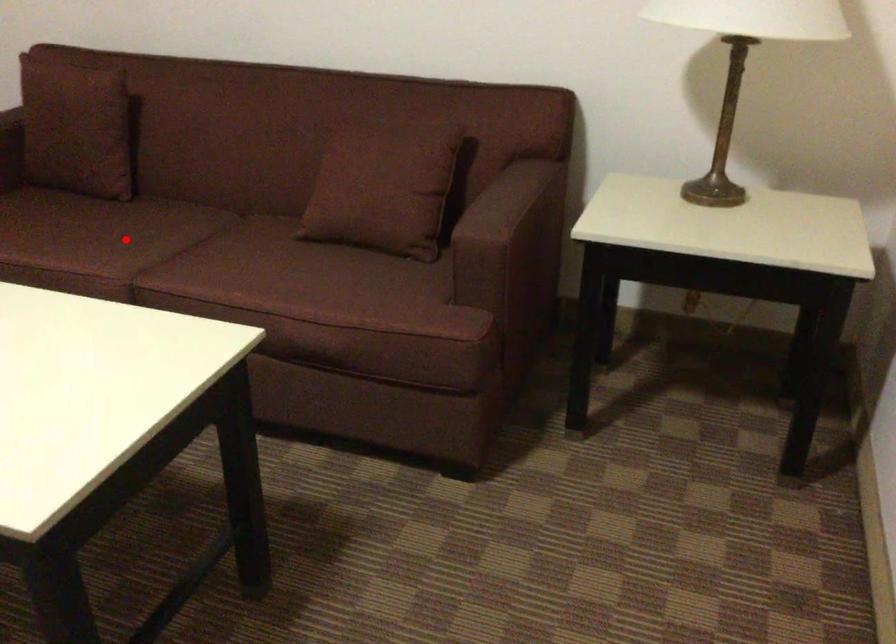
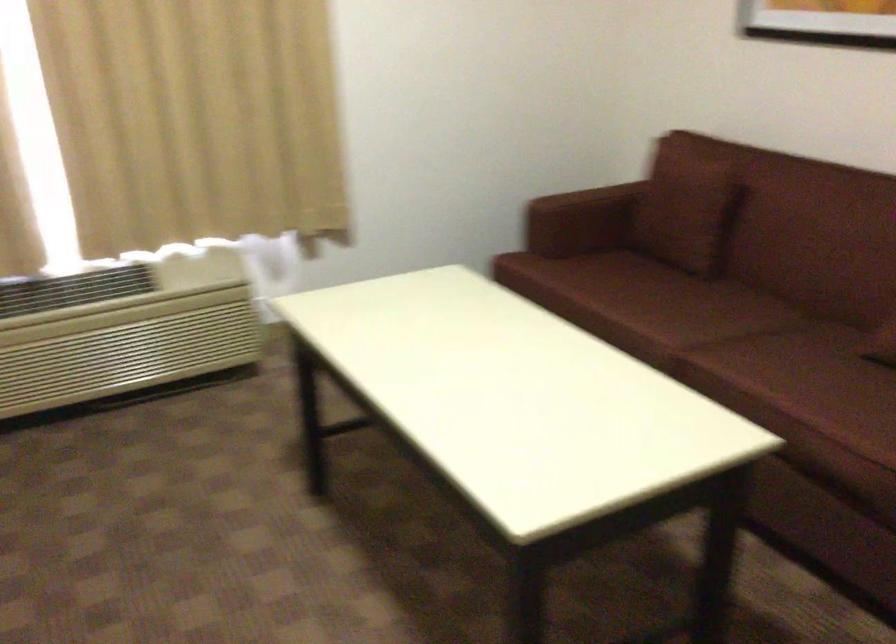
Question: I am providing you with two images of the same scene from different viewpoints. A red point is marked on the first image. At the location where the point appears in image 1, is it still visible in image 2?

Choices:
 (A) Yes
 (B) No

Answer: (A)